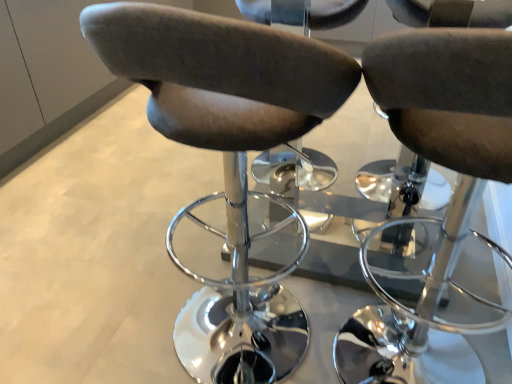
Locate an element on the screen. The height and width of the screenshot is (384, 512). suede-like brown chair at center, acting as the first chair starting from the left is located at coordinates (229, 170).

Describe the element at coordinates (229, 170) in the screenshot. I see `suede-like brown chair at center, the second chair in the right-to-left sequence` at that location.

Where is `suede-like brown chair at center, which is the 1th chair in right-to-left order`? This screenshot has width=512, height=384. suede-like brown chair at center, which is the 1th chair in right-to-left order is located at coordinates (437, 160).

Describe the element at coordinates (437, 160) in the screenshot. I see `suede-like brown chair at center, which is the 1th chair in right-to-left order` at that location.

What are the coordinates of `suede-like brown chair at center, acting as the first chair starting from the left` in the screenshot? It's located at (229, 170).

Is suede-like brown chair at center, which is the 1th chair in right-to-left order, to the right of suede-like brown chair at center, acting as the first chair starting from the left, from the viewer's perspective?

Yes, suede-like brown chair at center, which is the 1th chair in right-to-left order, is to the right of suede-like brown chair at center, acting as the first chair starting from the left.

Is suede-like brown chair at center, which is the 1th chair in right-to-left order, further to the viewer compared to suede-like brown chair at center, acting as the first chair starting from the left?

That is False.

Considering the positions of point (377, 81) and point (181, 228), is point (377, 81) closer or farther from the camera than point (181, 228)?

Clearly, point (377, 81) is closer to the camera than point (181, 228).

From the picture: From the image's perspective, is suede-like brown chair at center, the second chair from the left, located beneath suede-like brown chair at center, acting as the first chair starting from the left?

Yes.

From a real-world perspective, relative to suede-like brown chair at center, acting as the first chair starting from the left, is suede-like brown chair at center, which is the 1th chair in right-to-left order, vertically above or below?

Clearly, from a real-world perspective, suede-like brown chair at center, which is the 1th chair in right-to-left order, is below suede-like brown chair at center, acting as the first chair starting from the left.

Looking at their sizes, would you say suede-like brown chair at center, the second chair from the left, is wider or thinner than suede-like brown chair at center, the second chair in the right-to-left sequence?

Clearly, suede-like brown chair at center, the second chair from the left, has more width compared to suede-like brown chair at center, the second chair in the right-to-left sequence.

Considering the sizes of objects suede-like brown chair at center, the second chair from the left, and suede-like brown chair at center, acting as the first chair starting from the left, in the image provided, who is shorter, suede-like brown chair at center, the second chair from the left, or suede-like brown chair at center, acting as the first chair starting from the left,?

Standing shorter between the two is suede-like brown chair at center, the second chair from the left.

In terms of size, does suede-like brown chair at center, which is the 1th chair in right-to-left order, appear bigger or smaller than suede-like brown chair at center, acting as the first chair starting from the left?

In the image, suede-like brown chair at center, which is the 1th chair in right-to-left order, appears to be smaller than suede-like brown chair at center, acting as the first chair starting from the left.

Would you say suede-like brown chair at center, the second chair from the left, is outside suede-like brown chair at center, acting as the first chair starting from the left?

Yes, suede-like brown chair at center, the second chair from the left, is located beyond the bounds of suede-like brown chair at center, acting as the first chair starting from the left.

Is suede-like brown chair at center, the second chair from the left, not close to suede-like brown chair at center, the second chair in the right-to-left sequence?

Actually, suede-like brown chair at center, the second chair from the left, and suede-like brown chair at center, the second chair in the right-to-left sequence, are a little close together.

Is suede-like brown chair at center, which is the 1th chair in right-to-left order, oriented away from suede-like brown chair at center, acting as the first chair starting from the left?

No, suede-like brown chair at center, which is the 1th chair in right-to-left order, is not facing away from suede-like brown chair at center, acting as the first chair starting from the left.

Could you measure the distance between suede-like brown chair at center, the second chair from the left, and suede-like brown chair at center, acting as the first chair starting from the left?

A distance of 42.22 centimeters exists between suede-like brown chair at center, the second chair from the left, and suede-like brown chair at center, acting as the first chair starting from the left.

Locate an element on the screen. chair lying below the suede-like brown chair at center, the second chair in the right-to-left sequence (from the image's perspective) is located at coordinates (437, 160).

Visually, is suede-like brown chair at center, acting as the first chair starting from the left, positioned to the left or to the right of suede-like brown chair at center, which is the 1th chair in right-to-left order?

From the image, it's evident that suede-like brown chair at center, acting as the first chair starting from the left, is to the left of suede-like brown chair at center, which is the 1th chair in right-to-left order.

Considering the positions of objects suede-like brown chair at center, acting as the first chair starting from the left, and suede-like brown chair at center, which is the 1th chair in right-to-left order, in the image provided, who is behind, suede-like brown chair at center, acting as the first chair starting from the left, or suede-like brown chair at center, which is the 1th chair in right-to-left order,?

suede-like brown chair at center, acting as the first chair starting from the left, is further away from the camera.

Which is farther from the camera, (x=229, y=223) or (x=488, y=151)?

Positioned behind is point (x=229, y=223).

From the image's perspective, is suede-like brown chair at center, the second chair in the right-to-left sequence, located above or below suede-like brown chair at center, which is the 1th chair in right-to-left order?

suede-like brown chair at center, the second chair in the right-to-left sequence, is situated higher than suede-like brown chair at center, which is the 1th chair in right-to-left order, in the image.

From a real-world perspective, is suede-like brown chair at center, acting as the first chair starting from the left, beneath suede-like brown chair at center, the second chair from the left?

No, from a real-world perspective, suede-like brown chair at center, acting as the first chair starting from the left, is not under suede-like brown chair at center, the second chair from the left.

Can you confirm if suede-like brown chair at center, the second chair in the right-to-left sequence, is wider than suede-like brown chair at center, the second chair from the left?

No, suede-like brown chair at center, the second chair in the right-to-left sequence, is not wider than suede-like brown chair at center, the second chair from the left.

Considering the relative sizes of suede-like brown chair at center, acting as the first chair starting from the left, and suede-like brown chair at center, which is the 1th chair in right-to-left order, in the image provided, is suede-like brown chair at center, acting as the first chair starting from the left, shorter than suede-like brown chair at center, which is the 1th chair in right-to-left order,?

No.

Considering the relative sizes of suede-like brown chair at center, the second chair in the right-to-left sequence, and suede-like brown chair at center, the second chair from the left, in the image provided, is suede-like brown chair at center, the second chair in the right-to-left sequence, bigger than suede-like brown chair at center, the second chair from the left,?

Yes, suede-like brown chair at center, the second chair in the right-to-left sequence, is bigger than suede-like brown chair at center, the second chair from the left.

Could suede-like brown chair at center, which is the 1th chair in right-to-left order, be considered to be inside suede-like brown chair at center, acting as the first chair starting from the left?

No, suede-like brown chair at center, acting as the first chair starting from the left, does not contain suede-like brown chair at center, which is the 1th chair in right-to-left order.

Is suede-like brown chair at center, the second chair in the right-to-left sequence, not near suede-like brown chair at center, the second chair from the left?

No, suede-like brown chair at center, the second chair in the right-to-left sequence, is not far from suede-like brown chair at center, the second chair from the left.

Is suede-like brown chair at center, the second chair in the right-to-left sequence, facing towards suede-like brown chair at center, which is the 1th chair in right-to-left order?

No, suede-like brown chair at center, the second chair in the right-to-left sequence, is not aimed at suede-like brown chair at center, which is the 1th chair in right-to-left order.

Find the location of `chair below the suede-like brown chair at center, acting as the first chair starting from the left (from the image's perspective)`. chair below the suede-like brown chair at center, acting as the first chair starting from the left (from the image's perspective) is located at coordinates (437, 160).

The image size is (512, 384). I want to click on chair lying on the right of suede-like brown chair at center, the second chair in the right-to-left sequence, so click(x=437, y=160).

Locate an element on the screen. The image size is (512, 384). chair on the left of suede-like brown chair at center, which is the 1th chair in right-to-left order is located at coordinates (229, 170).